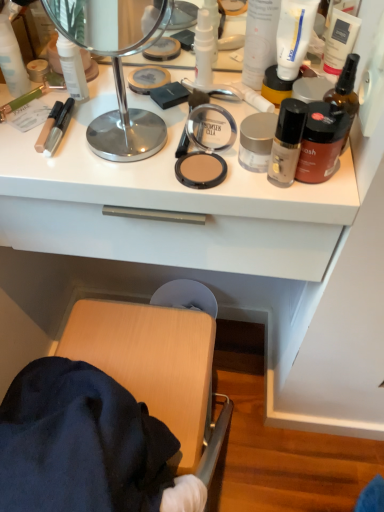
Locate an element on the screen. free space to the left of matte brown bottle at upper right, acting as the ninth toiletry starting from the left is located at coordinates (x=192, y=163).